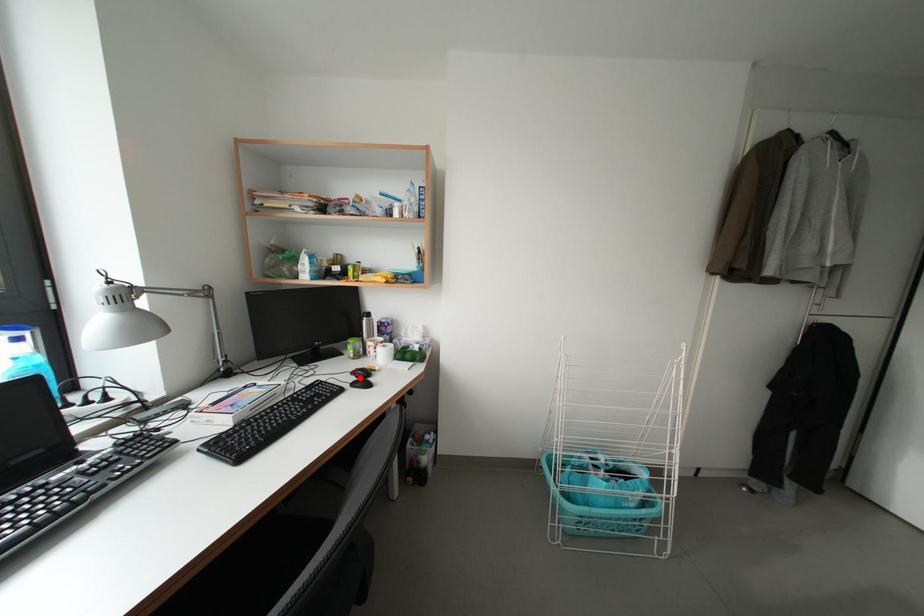
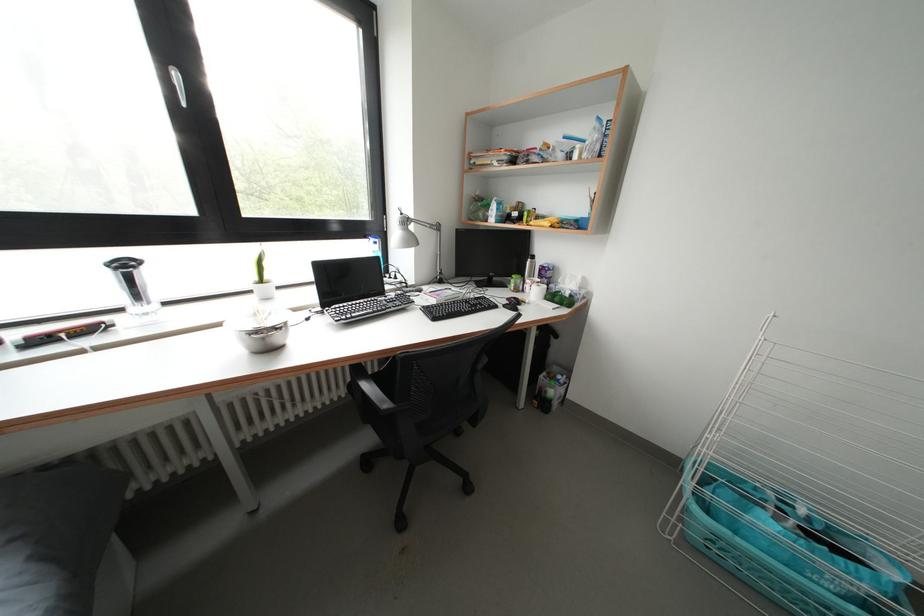
The point at the highlighted location is marked in the first image. Where is the corresponding point in the second image?

(515, 304)